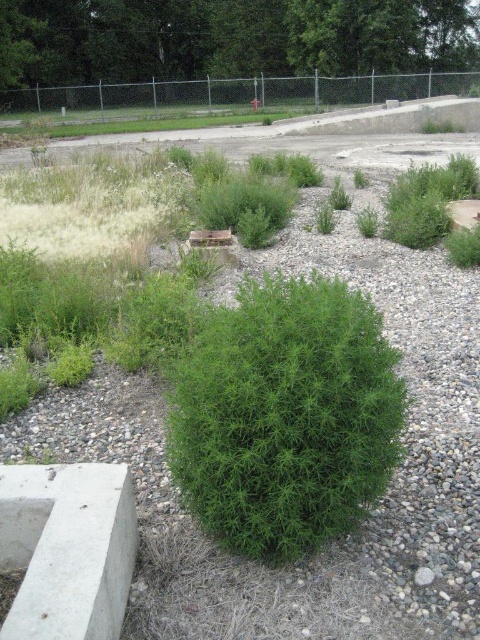
Question: Which point is closer to the camera taking this photo?

Choices:
 (A) (296, 340)
 (B) (354, 13)

Answer: (A)

Question: Can you confirm if green leafy shrub at center is thinner than green leafy bush at center?

Choices:
 (A) yes
 (B) no

Answer: (A)

Question: Which object is closer to the camera taking this photo?

Choices:
 (A) green leafy shrub at center
 (B) green leafy bush at center

Answer: (A)

Question: In this image, where is green leafy shrub at center located relative to green leafy bush at center?

Choices:
 (A) below
 (B) above

Answer: (A)

Question: Is green leafy shrub at center wider than green leafy bush at center?

Choices:
 (A) yes
 (B) no

Answer: (B)

Question: Which point is closer to the camera?

Choices:
 (A) green leafy shrub at center
 (B) green leafy bush at center

Answer: (A)